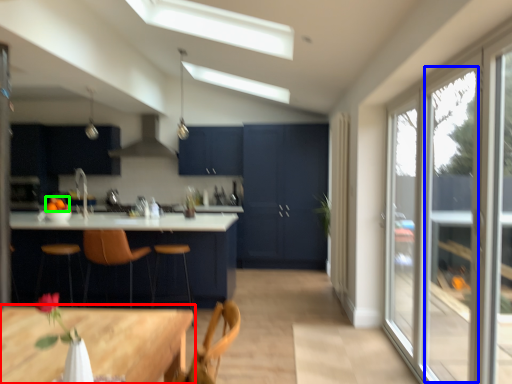
Question: Which is nearer to the table (highlighted by a red box)? window (highlighted by a blue box) or fruit (highlighted by a green box).

Choices:
 (A) window
 (B) fruit

Answer: (A)